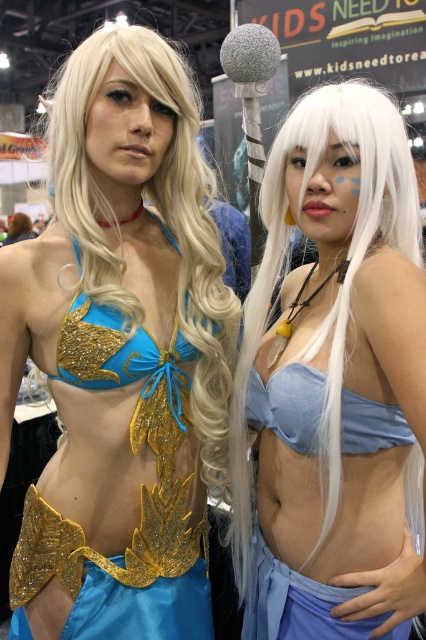
You are a costume designer assessing two bikinis for a performance. The first is the matte gold bikini top at center, and the second is the blue satin bikini top at center. Which one is wider?

The matte gold bikini top at center is wider than the blue satin bikini top at center.

You are a photographer at a costume event. You need to capture a clear shot of both the matte gold bikini top at center and the blue satin bikini top at center. Which one should you focus on first to ensure it appears sharp in the photo?

You should focus on the matte gold bikini top at center first because it is closer to the viewer than the blue satin bikini top at center, ensuring it will be sharp in the photo.